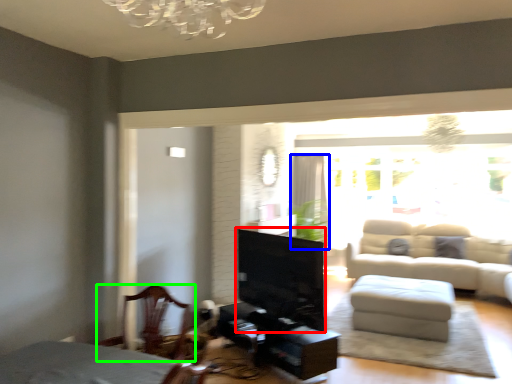
Question: Based on their relative distances, which object is farther from fireplace (highlighted by a red box)? Choose from curtain (highlighted by a blue box) and chair (highlighted by a green box).

Choices:
 (A) curtain
 (B) chair

Answer: (A)